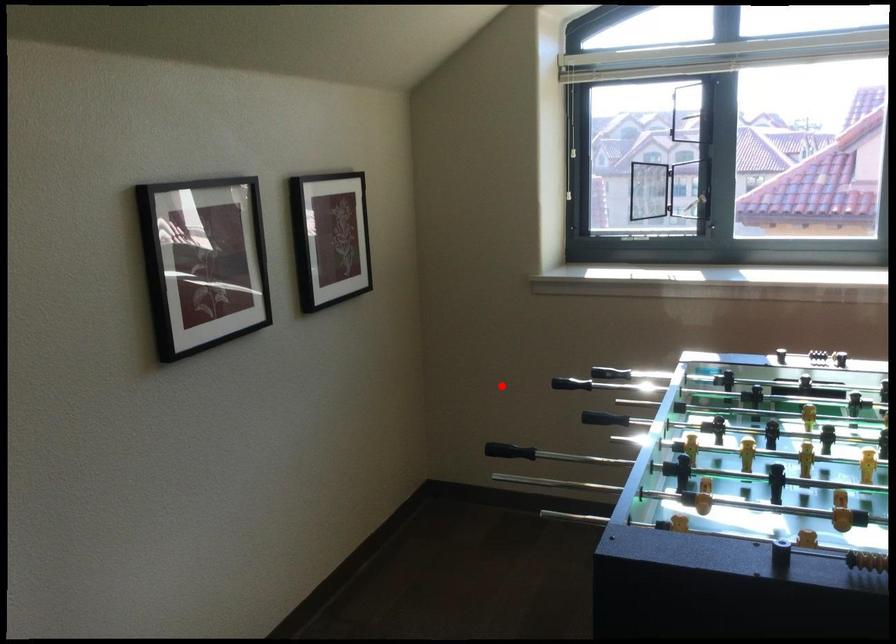
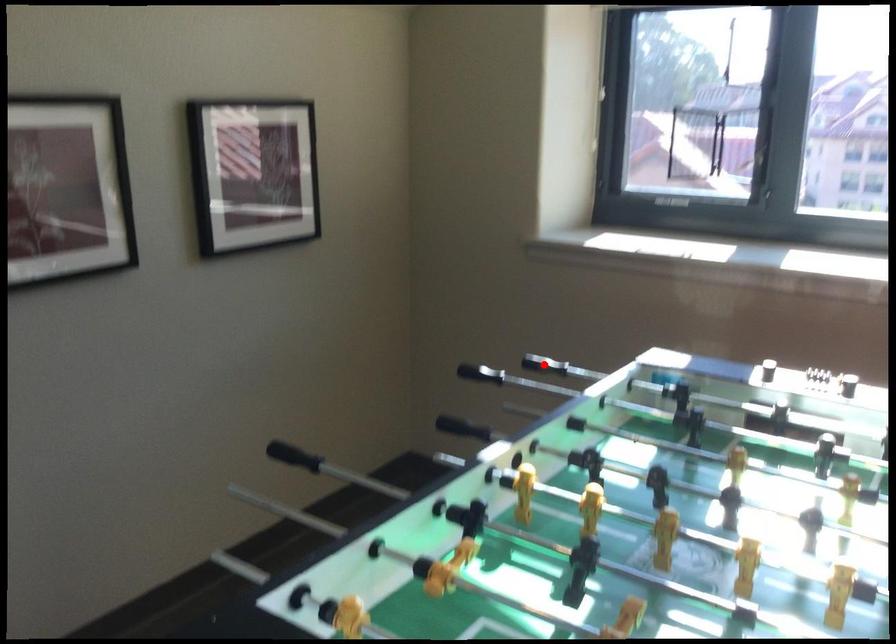
I am providing you with two images of the same scene from different viewpoints. A red point is marked on the first image and another point is marked on the second image. Do the highlighted points in image1 and image2 indicate the same real-world spot?

No